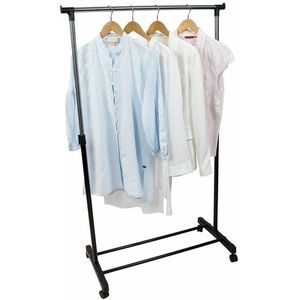
Locate an element on the screen. The image size is (300, 300). rods is located at coordinates (173, 255), (162, 237), (218, 191), (94, 217), (122, 5).